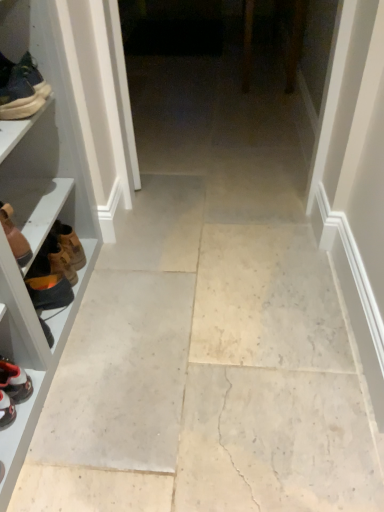
Question: From the image's perspective, is orange suede boot at left, which is the second footwear in bottom-to-top order, on brown leather boot at left, the second footwear from the top?

Choices:
 (A) no
 (B) yes

Answer: (A)

Question: From the image's perspective, is orange suede boot at left, which is the second footwear in bottom-to-top order, located beneath brown leather boot at left, the second footwear from the top?

Choices:
 (A) no
 (B) yes

Answer: (B)

Question: Considering the relative sizes of orange suede boot at left, the third footwear from the top, and brown leather boot at left, the 3th footwear ordered from the bottom, in the image provided, is orange suede boot at left, the third footwear from the top, wider than brown leather boot at left, the 3th footwear ordered from the bottom,?

Choices:
 (A) no
 (B) yes

Answer: (A)

Question: Is orange suede boot at left, the third footwear from the top, positioned before brown leather boot at left, the second footwear from the top?

Choices:
 (A) yes
 (B) no

Answer: (B)

Question: Is orange suede boot at left, the third footwear from the top, to the right of brown leather boot at left, the second footwear from the top, from the viewer's perspective?

Choices:
 (A) no
 (B) yes

Answer: (B)

Question: From the image's perspective, is white leather sneaker at lower left, positioned as the 1th footwear in bottom-to-top order, above or below brown leather boot at left, the 3th footwear ordered from the bottom?

Choices:
 (A) below
 (B) above

Answer: (A)

Question: In terms of height, does white leather sneaker at lower left, positioned as the 1th footwear in bottom-to-top order, look taller or shorter compared to brown leather boot at left, the second footwear from the top?

Choices:
 (A) short
 (B) tall

Answer: (A)

Question: Does point (26, 381) appear closer or farther from the camera than point (21, 245)?

Choices:
 (A) closer
 (B) farther

Answer: (B)

Question: Visually, is white leather sneaker at lower left, positioned as the 1th footwear in bottom-to-top order, positioned to the left or to the right of brown leather boot at left, the 3th footwear ordered from the bottom?

Choices:
 (A) left
 (B) right

Answer: (A)

Question: Looking at the image, does brown leather boot at left, the 3th footwear ordered from the bottom, seem bigger or smaller compared to white leather sneaker at lower left, positioned as the 1th footwear in bottom-to-top order?

Choices:
 (A) big
 (B) small

Answer: (A)

Question: Which is correct: brown leather boot at left, the 3th footwear ordered from the bottom, is inside white leather sneaker at lower left, which ranks as the 4th footwear in top-to-bottom order, or outside of it?

Choices:
 (A) outside
 (B) inside

Answer: (A)

Question: From a real-world perspective, is brown leather boot at left, the 3th footwear ordered from the bottom, above or below white leather sneaker at lower left, which ranks as the 4th footwear in top-to-bottom order?

Choices:
 (A) below
 (B) above

Answer: (B)

Question: In the image, is brown leather boot at left, the second footwear from the top, on the left side or the right side of white leather sneaker at lower left, positioned as the 1th footwear in bottom-to-top order?

Choices:
 (A) left
 (B) right

Answer: (B)

Question: Is matte black sneaker at left, which is counted as the 1th footwear, starting from the top, wider or thinner than orange suede boot at left, which is the second footwear in bottom-to-top order?

Choices:
 (A) thin
 (B) wide

Answer: (B)

Question: Is point (44, 92) positioned closer to the camera than point (54, 300)?

Choices:
 (A) closer
 (B) farther

Answer: (A)